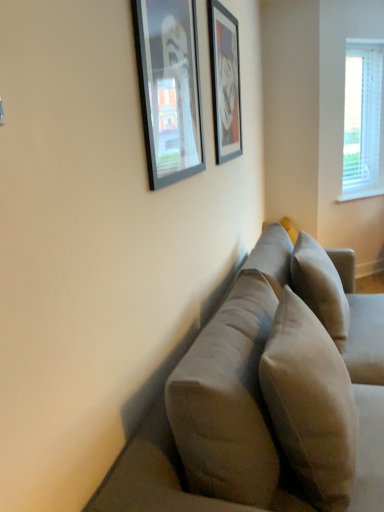
Question: Does white blinds at upper right appear on the left side of beige fabric pillow at center, arranged as the second pillow when viewed from the front?

Choices:
 (A) yes
 (B) no

Answer: (B)

Question: From the image's perspective, does white blinds at upper right appear lower than beige fabric pillow at center, arranged as the 1th pillow when viewed from the back?

Choices:
 (A) no
 (B) yes

Answer: (A)

Question: Is white blinds at upper right taller than beige fabric pillow at center, arranged as the second pillow when viewed from the front?

Choices:
 (A) yes
 (B) no

Answer: (A)

Question: Does white blinds at upper right have a greater width compared to beige fabric pillow at center, arranged as the second pillow when viewed from the front?

Choices:
 (A) yes
 (B) no

Answer: (B)

Question: Does white blinds at upper right lie in front of beige fabric pillow at center, arranged as the 1th pillow when viewed from the back?

Choices:
 (A) no
 (B) yes

Answer: (A)

Question: Is white blinds at upper right looking in the opposite direction of beige fabric pillow at center, arranged as the 1th pillow when viewed from the back?

Choices:
 (A) no
 (B) yes

Answer: (A)

Question: From the image's perspective, is suede-like beige pillow at center, which is the 2th pillow from back to front, on top of beige fabric pillow at center, arranged as the 1th pillow when viewed from the back?

Choices:
 (A) no
 (B) yes

Answer: (A)

Question: Is suede-like beige pillow at center, which is the 2th pillow from back to front, smaller than beige fabric pillow at center, arranged as the second pillow when viewed from the front?

Choices:
 (A) yes
 (B) no

Answer: (A)

Question: Would you say suede-like beige pillow at center, which is the 2th pillow from back to front, contains beige fabric pillow at center, arranged as the second pillow when viewed from the front?

Choices:
 (A) yes
 (B) no

Answer: (B)

Question: Can you see suede-like beige pillow at center, which is the 2th pillow from back to front, touching beige fabric pillow at center, arranged as the second pillow when viewed from the front?

Choices:
 (A) yes
 (B) no

Answer: (B)

Question: From a real-world perspective, is suede-like beige pillow at center, the first pillow viewed from the front, on beige fabric pillow at center, arranged as the second pillow when viewed from the front?

Choices:
 (A) no
 (B) yes

Answer: (B)

Question: Is suede-like beige pillow at center, which is the 2th pillow from back to front, facing towards beige fabric pillow at center, arranged as the 1th pillow when viewed from the back?

Choices:
 (A) no
 (B) yes

Answer: (A)

Question: From the image's perspective, is suede-like beige couch at center on top of beige fabric pillow at center, arranged as the 1th pillow when viewed from the back?

Choices:
 (A) yes
 (B) no

Answer: (B)